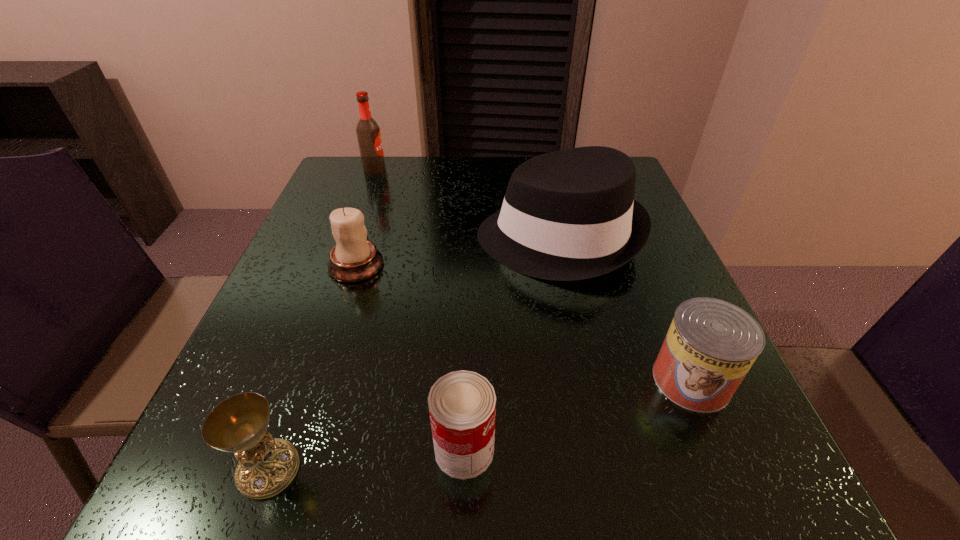
Locate an element on the screen. The width and height of the screenshot is (960, 540). beer bottle is located at coordinates tap(368, 133).

Locate an element on the screen. fedora is located at coordinates (567, 215).

Find the location of a particular element. This screenshot has width=960, height=540. candle holder is located at coordinates (353, 259).

You are a GUI agent. You are given a task and a screenshot of the screen. Output one action in this format:
    pyautogui.click(x=<x>, y=<y>)
    Task: Click on the fourth farthest object
    This screenshot has width=960, height=540.
    Given the screenshot: What is the action you would take?
    pyautogui.click(x=711, y=344)

Image resolution: width=960 pixels, height=540 pixels. I want to click on the right can, so click(711, 344).

You are a GUI agent. You are given a task and a screenshot of the screen. Output one action in this format:
    pyautogui.click(x=<x>, y=<y>)
    Task: Click on the left can
    
    Given the screenshot: What is the action you would take?
    pyautogui.click(x=462, y=405)

Identify the location of chalice. The height and width of the screenshot is (540, 960). (267, 465).

Where is `vacant space situated on the right of the farthest object`? The height and width of the screenshot is (540, 960). vacant space situated on the right of the farthest object is located at coordinates (x=518, y=170).

You are a GUI agent. You are given a task and a screenshot of the screen. Output one action in this format:
    pyautogui.click(x=<x>, y=<y>)
    Task: Click on the vacant space located 0.110m on the left of the fedora
    This screenshot has width=960, height=540.
    Given the screenshot: What is the action you would take?
    pyautogui.click(x=427, y=238)

Locate an element on the screen. This screenshot has height=540, width=960. vacant area situated 0.300m on the back of the candle holder is located at coordinates (384, 178).